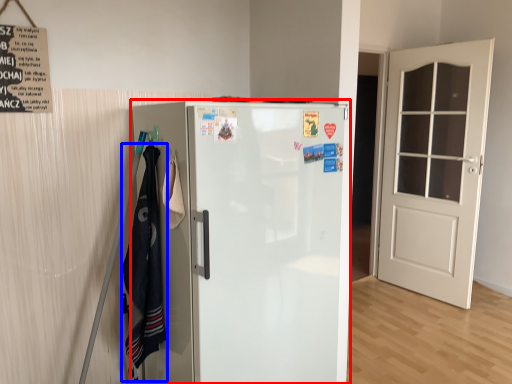
Question: Which of the following is the farthest to the observer, refrigerator (highlighted by a red box) or laundry (highlighted by a blue box)?

Choices:
 (A) refrigerator
 (B) laundry

Answer: (B)